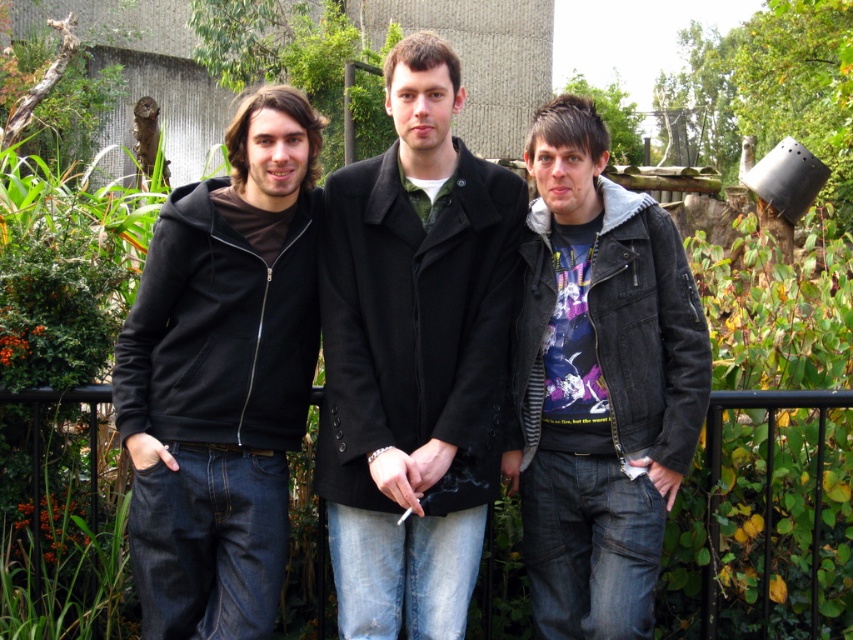
You are a tailor who needs to determine which clothing item requires more fabric to alter. Based on the image, which of the two items, the black wool coat at center or the black matte hoodie at left, would need more fabric for alterations?

The black wool coat at center requires more fabric for alterations since it is larger in size than the black matte hoodie at left.

You are standing in a garden and want to place a small bench at point (370, 609). The bench requires 12 feet of space from the viewer to be visible. Is the point far enough?

The distance of point (370, 609) from viewer is 14.36 feet, which is more than the required 12 feet, so the bench will be visible.

You are a photographer trying to capture a photo of the black wool coat at center and the black metal fence at center. Based on their positions, which object is closer to the camera?

The black wool coat at center is located above the black metal fence at center, meaning it is closer to the camera.